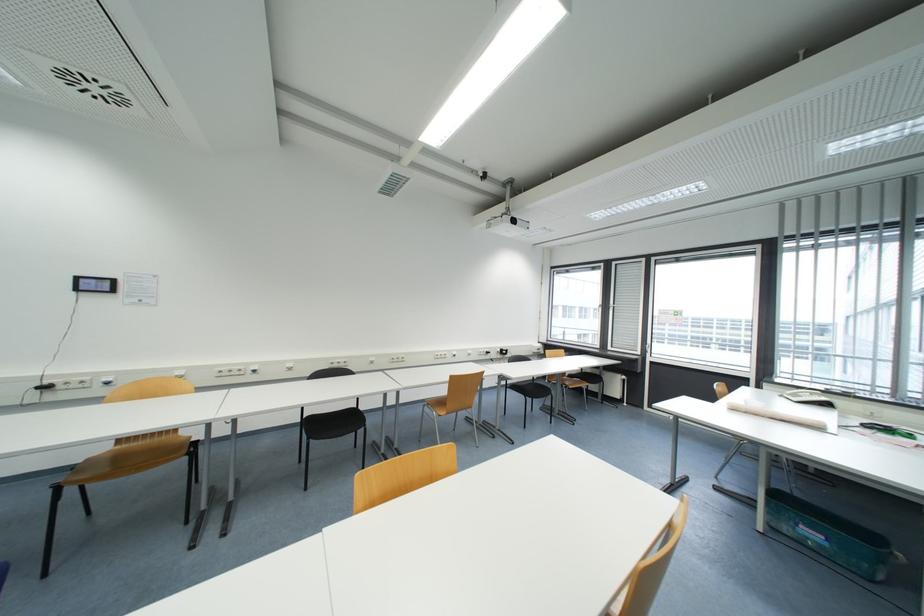
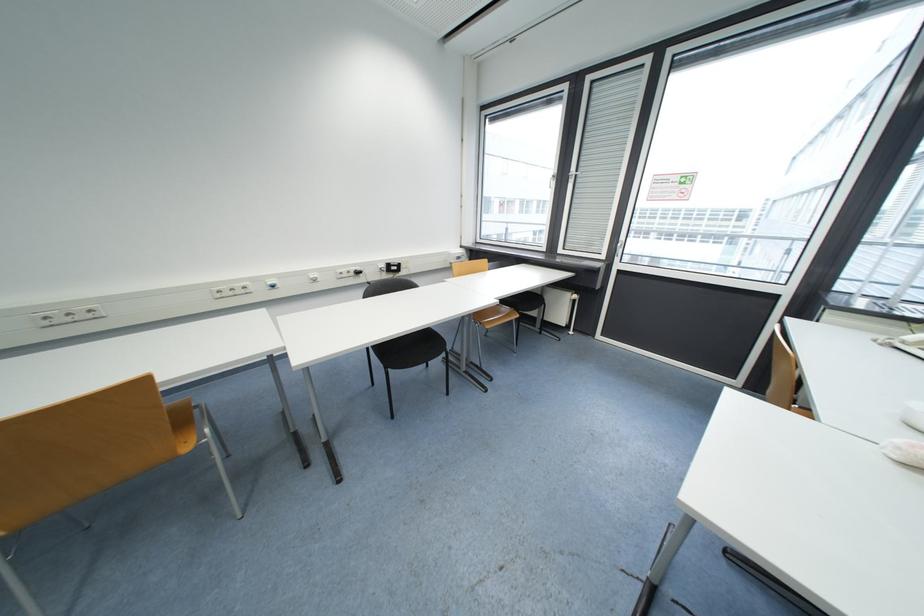
Question: I am providing you with two images of the same scene from different viewpoints. After the viewpoint changes to image2, which objects are now occluded?

Choices:
 (A) blue wall switch
 (B) brown chair sitting surface
 (C) blind pull strap
 (D) none of these

Answer: (D)